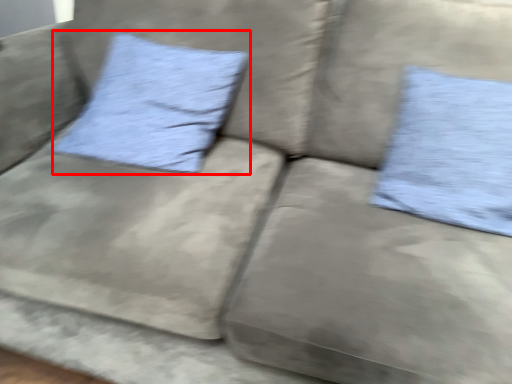
Question: In this image, where is pillow (annotated by the red box) located relative to pillow?

Choices:
 (A) right
 (B) left

Answer: (B)